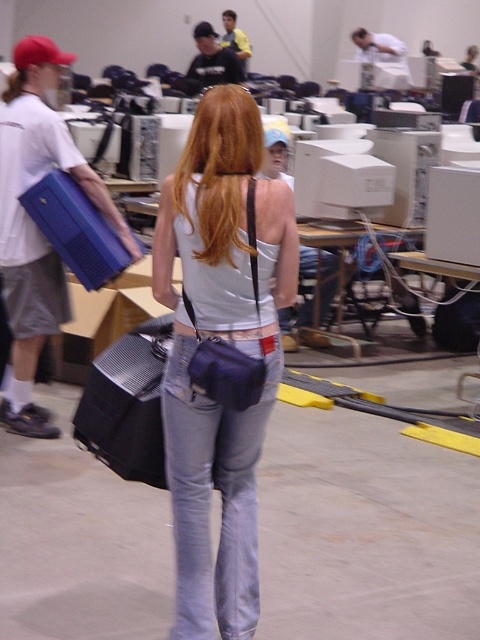
You are standing in the warehouse and see the matte blue briefcase at left and the blonde hair at center. Which one is closer to you?

The matte blue briefcase at left is closer to you because the blonde hair at center is behind it.

Consider the image. You are standing at the origin of the coordinate system in the warehouse. There is a point at coordinate (220, 352). What object is located at that point?

The object at coordinate (220, 352) is the matte blue purse at center.

You are a security guard in the warehouse and need to locate two items for inventory. The items are the matte blue purse at center and the matte blue briefcase at left. According to the scene, which item is positioned to the right of the other?

→ The matte blue purse at center is to the right of the matte blue briefcase at left.